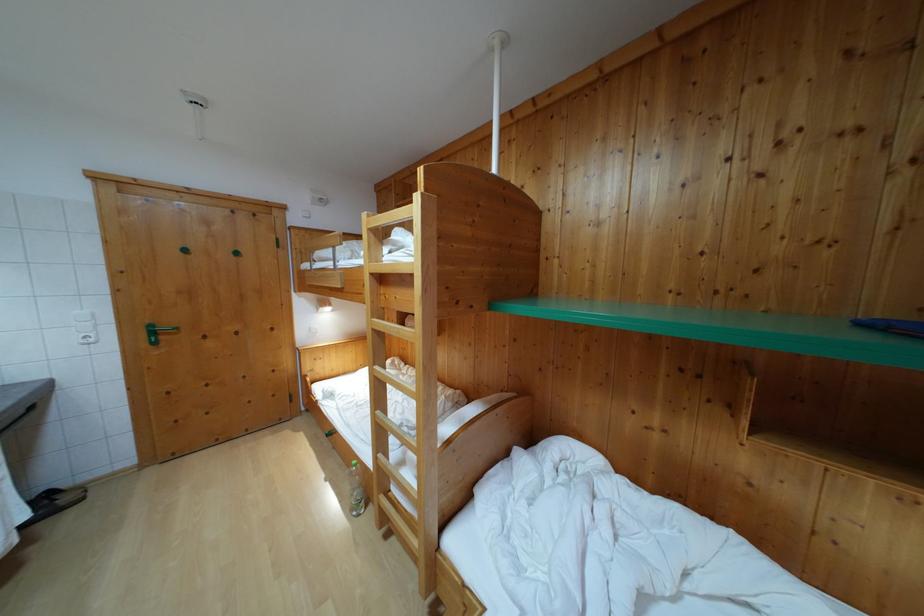
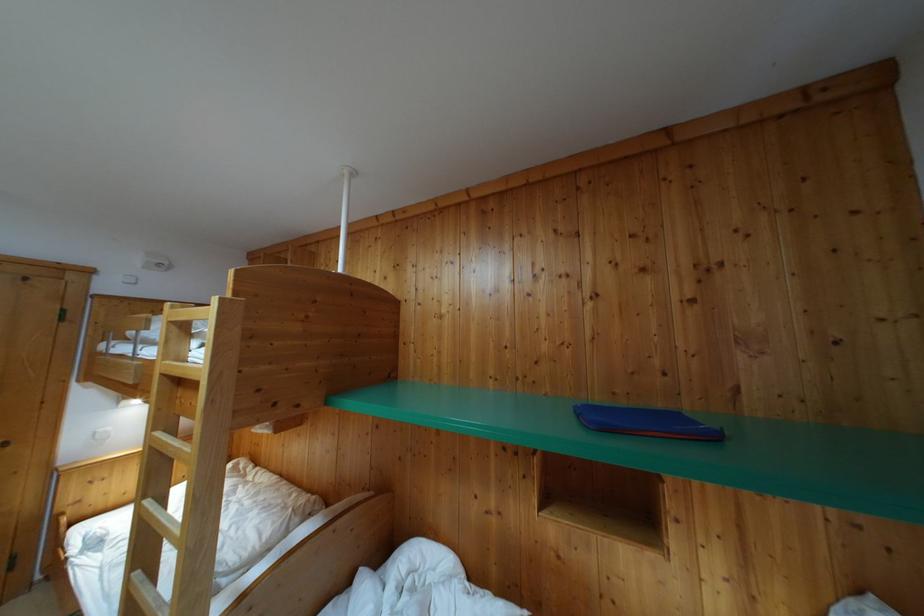
What movement of the cameraman would produce the second image?

The cameraman walked toward right, backward.